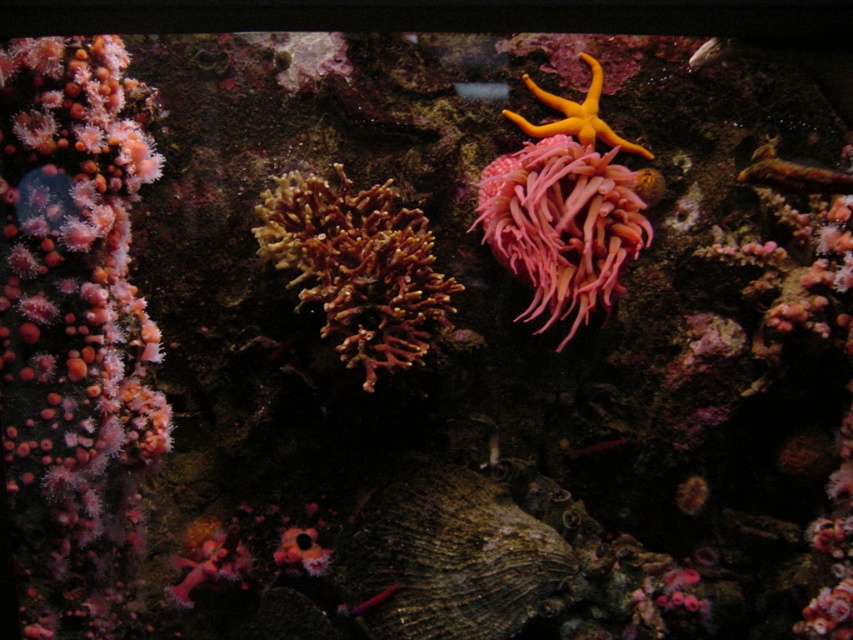
Who is higher up, rough textured shell at center or pink soft coral at center?

pink soft coral at center

From the picture: Is rough textured shell at center to the right of pink soft coral at center from the viewer's perspective?

In fact, rough textured shell at center is to the left of pink soft coral at center.

Is point (498, 547) positioned in front of point (605, 259)?

Yes, point (498, 547) is in front of point (605, 259).

Locate an element on the screen. The height and width of the screenshot is (640, 853). rough textured shell at center is located at coordinates (448, 557).

From the picture: Who is positioned more to the right, rough textured shell at center or orange rubber starfish at upper center?

From the viewer's perspective, orange rubber starfish at upper center appears more on the right side.

Does rough textured shell at center have a greater width compared to orange rubber starfish at upper center?

Indeed, rough textured shell at center has a greater width compared to orange rubber starfish at upper center.

Identify the location of rough textured shell at center. (448, 557).

Identify the location of rough textured shell at center. (448, 557).

Who is positioned more to the left, pink coral at left or brown textured coral at center?

Positioned to the left is pink coral at left.

Between point (49, 92) and point (344, 272), which one is positioned behind?

The point (344, 272) is behind.

Image resolution: width=853 pixels, height=640 pixels. What are the coordinates of `pink coral at left` in the screenshot? It's located at (73, 323).